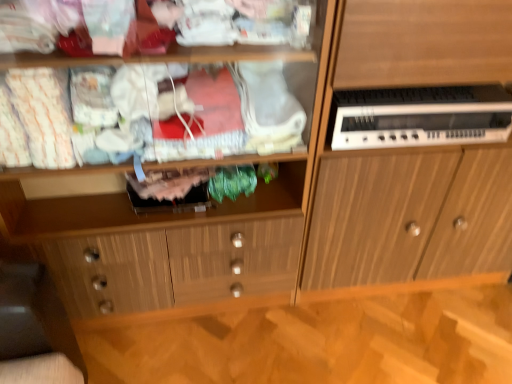
Question: Can you confirm if white plastic electronic device at right is smaller than wooden cabinet at center?

Choices:
 (A) no
 (B) yes

Answer: (B)

Question: Does white plastic electronic device at right lie in front of wooden cabinet at center?

Choices:
 (A) yes
 (B) no

Answer: (B)

Question: From a real-world perspective, is white plastic electronic device at right on top of wooden cabinet at center?

Choices:
 (A) no
 (B) yes

Answer: (B)

Question: Is wooden cabinet at center inside white plastic electronic device at right?

Choices:
 (A) no
 (B) yes

Answer: (A)

Question: Is white plastic electronic device at right thinner than wooden cabinet at center?

Choices:
 (A) no
 (B) yes

Answer: (B)

Question: From the image's perspective, is white plastic electronic device at right located beneath wooden cabinet at center?

Choices:
 (A) yes
 (B) no

Answer: (B)

Question: Is wooden cabinet at right thinner than wooden cabinet at center?

Choices:
 (A) yes
 (B) no

Answer: (B)

Question: Is wooden cabinet at right placed right next to wooden cabinet at center?

Choices:
 (A) yes
 (B) no

Answer: (B)

Question: From a real-world perspective, is wooden cabinet at right located higher than wooden cabinet at center?

Choices:
 (A) yes
 (B) no

Answer: (B)

Question: Can you confirm if wooden cabinet at right is wider than wooden cabinet at center?

Choices:
 (A) no
 (B) yes

Answer: (B)

Question: From a real-world perspective, is wooden cabinet at right below wooden cabinet at center?

Choices:
 (A) no
 (B) yes

Answer: (B)

Question: Does wooden cabinet at right appear on the right side of wooden cabinet at center?

Choices:
 (A) no
 (B) yes

Answer: (B)

Question: Would you say white plastic electronic device at right is part of wooden cabinet at right's contents?

Choices:
 (A) no
 (B) yes

Answer: (B)